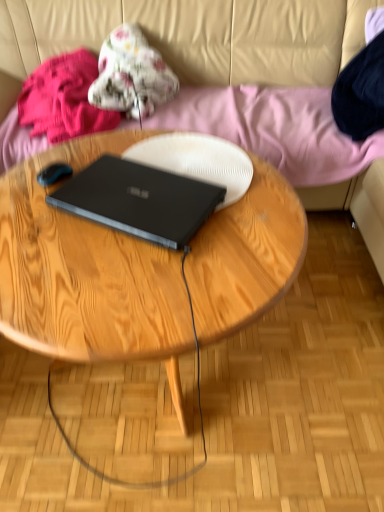
The height and width of the screenshot is (512, 384). Identify the location of space that is in front of black matte laptop at center. point(123,281).